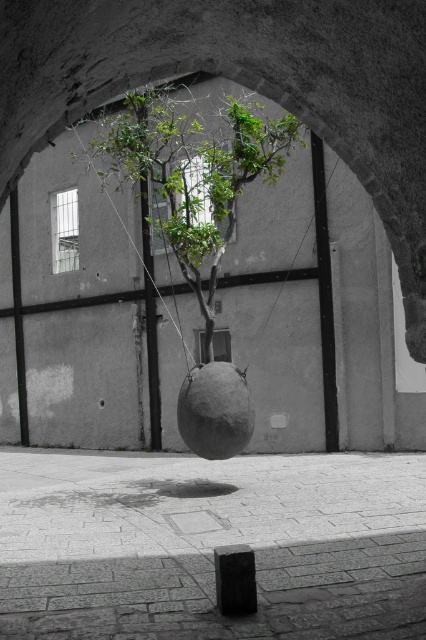
Who is more distant from viewer, (138, 136) or (316, 166)?

The point (316, 166) is more distant.

Who is more distant from viewer, (147, 177) or (282, 282)?

The point (147, 177) is behind.

Locate an element on the screen. This screenshot has height=640, width=426. green leafy tree at center is located at coordinates (192, 173).

Is point (242, 545) positioned in front of point (166, 252)?

Yes, point (242, 545) is in front of point (166, 252).

Is black stone at lower center wider than green leafy plant at center?

No.

Where is `black stone at lower center`? The height and width of the screenshot is (640, 426). black stone at lower center is located at coordinates (235, 579).

Is green leafy plant at center taller than black matte string at center?

No.

Where is `green leafy plant at center`? green leafy plant at center is located at coordinates (155, 288).